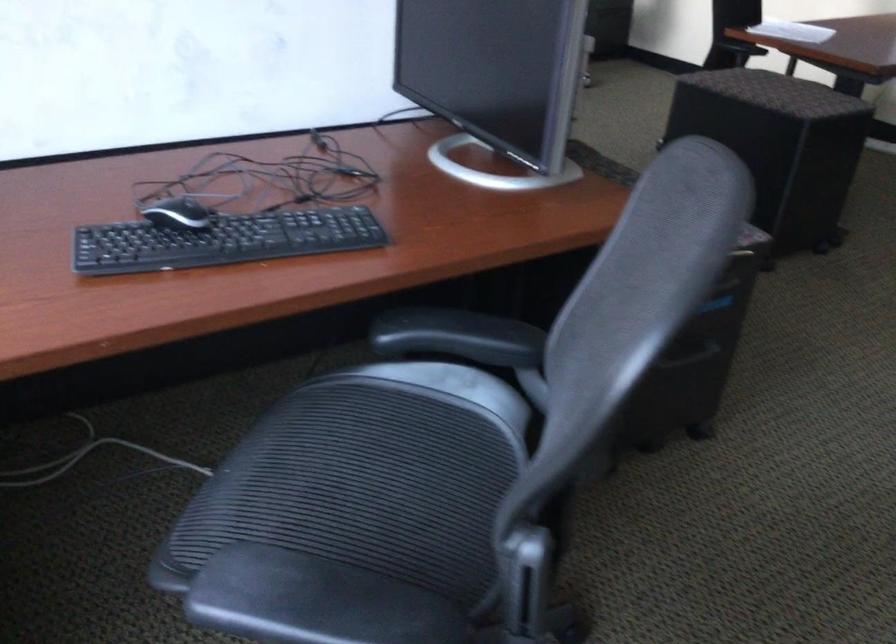
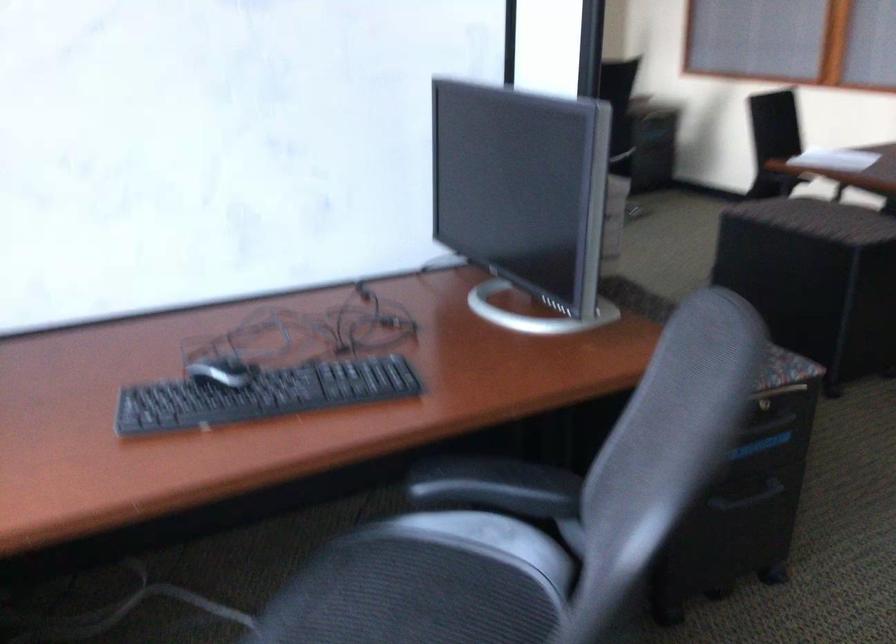
Question: The images are taken continuously from a first-person perspective. In which direction are you moving?

Choices:
 (A) Left
 (B) Right
 (C) Forward
 (D) Backward

Answer: (B)